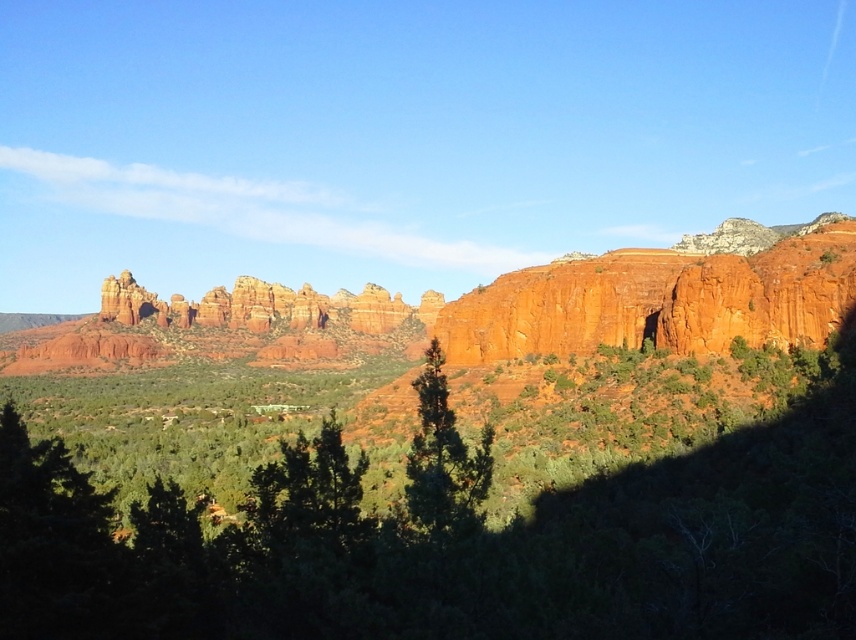
You are an environmental scientist analyzing the vegetation in the image. You observe the green leafy tree at center and the green matte tree at center. Which tree has a larger canopy size?

The green leafy tree at center has a larger canopy size than the green matte tree at center according to the description.